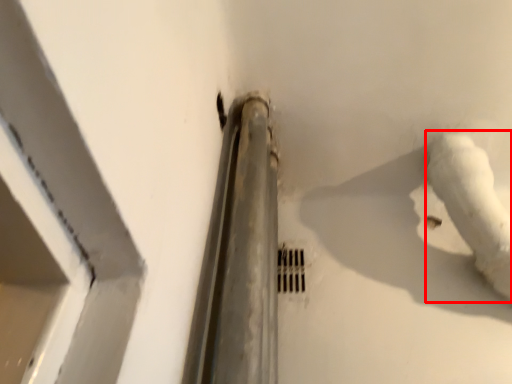
Question: From the image, what is the correct spatial relationship of water pipe (annotated by the red box) in relation to hole?

Choices:
 (A) right
 (B) left

Answer: (A)